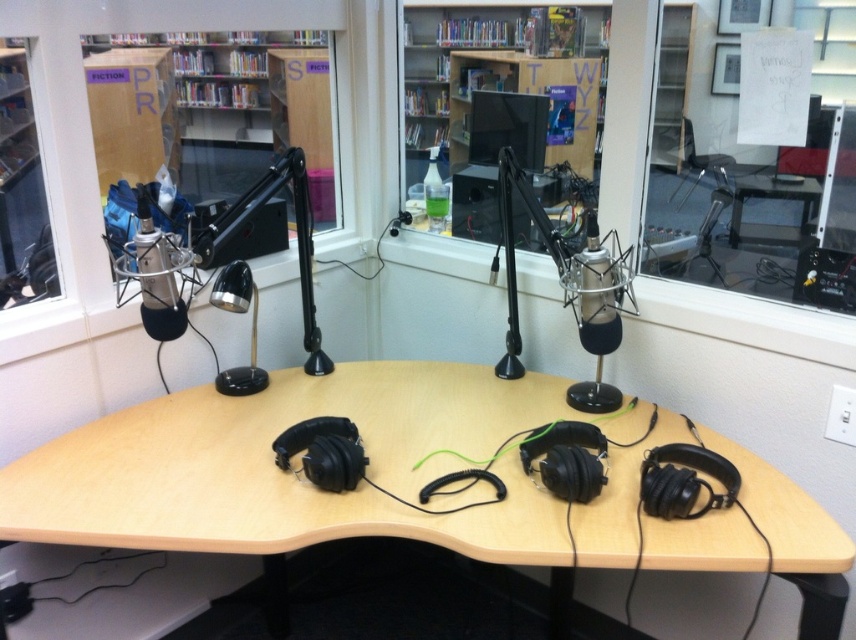
You are setting up a recording session in the studio. You need to place a rectangular box that is 1.2 meters wide on the wooden table at center. Considering the silver metallic microphone at center is already on the table, will the box fit on the table without overlapping the microphone?

The silver metallic microphone at center has a width larger than the wooden table at center. Since the microphone is already on the table, the table may not have enough space to accommodate the 1.2 meter wide box without overlapping the microphone.

You are a sound engineer setting up equipment in the studio. You need to place a new speaker between the wooden bookshelf at center and the matte black microphone at upper left. Which object should the speaker be closer to if it must be placed closer to the one that is nearer to you?

The wooden bookshelf at center is closer to you than the matte black microphone at upper left. Therefore, the speaker should be placed closer to the wooden bookshelf at center.

In the scene shown: You are setting up a recording session in the studio and need to place a large equipment box on the desk. The box is bigger than the silver metallic microphone at center. Will it fit on the wooden table at center?

The silver metallic microphone at center is larger in size than wooden table at center. Since the equipment box is bigger than the microphone, it will not fit on the wooden table at center.